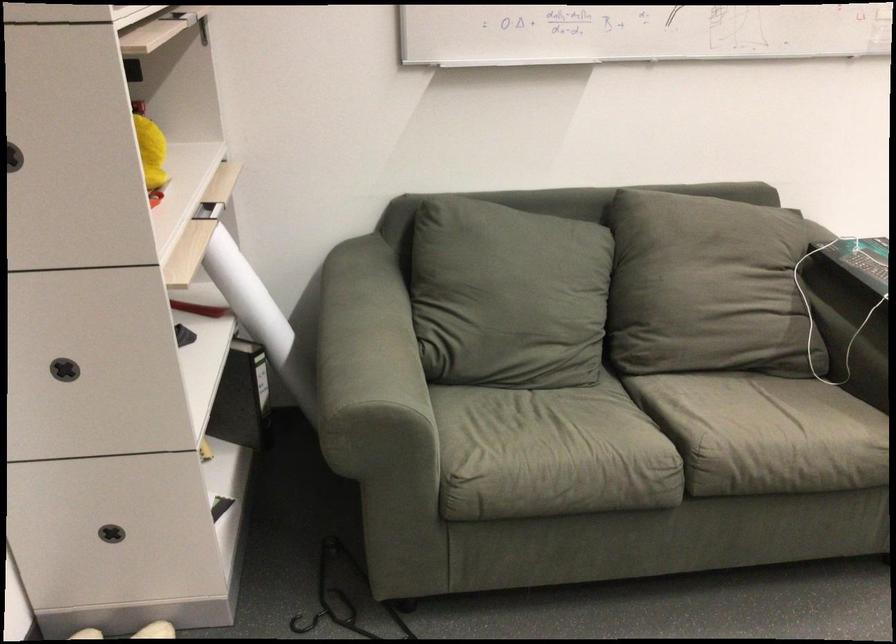
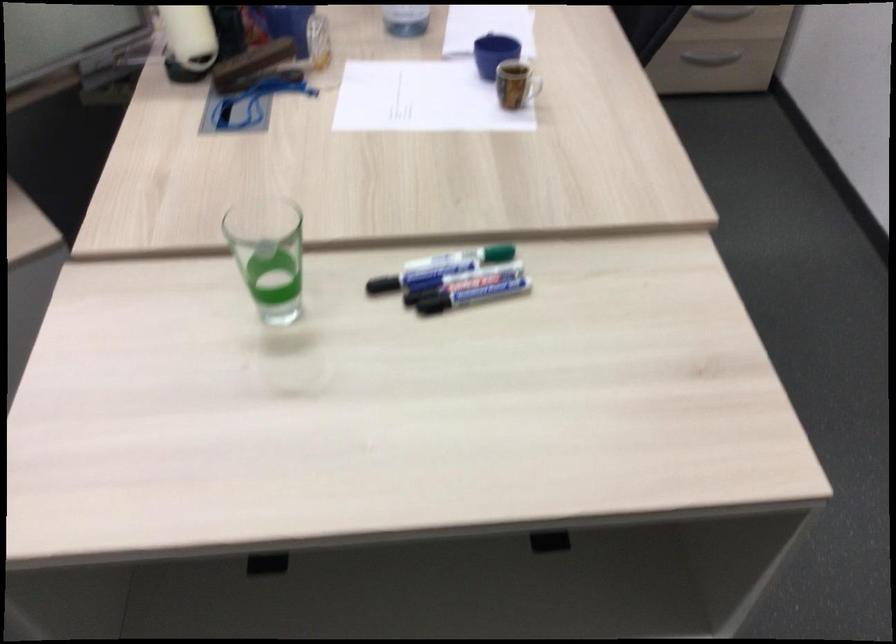
The first image is from the beginning of the video and the second image is from the end. How did the camera likely rotate when shooting the video?

The rotation direction of the camera is right-down.